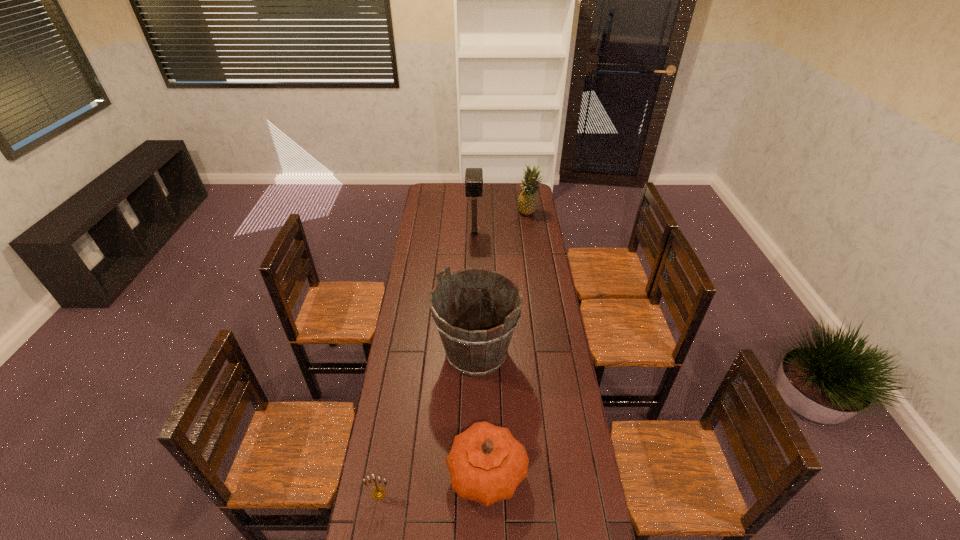
Locate an element on the screen. mallet is located at coordinates (473, 176).

You are a GUI agent. You are given a task and a screenshot of the screen. Output one action in this format:
    pyautogui.click(x=<x>, y=<y>)
    Task: Click on the bucket
    
    Given the screenshot: What is the action you would take?
    pyautogui.click(x=476, y=343)

At what (x,y) coordinates should I click in order to perform the action: click on pineapple. Please return your answer as a coordinate pair (x, y). The width and height of the screenshot is (960, 540). Looking at the image, I should click on (527, 201).

Image resolution: width=960 pixels, height=540 pixels. Find the location of `the rightmost object`. the rightmost object is located at coordinates (527, 201).

At what (x,y) coordinates should I click in order to perform the action: click on the second shortest object. Please return your answer as a coordinate pair (x, y). This screenshot has height=540, width=960. Looking at the image, I should click on (486, 463).

The image size is (960, 540). I want to click on the leftmost object, so click(x=378, y=493).

Locate an element on the screen. the shortest object is located at coordinates (378, 493).

Where is `free space located 0.270m on the back of the fourth nearest object`? free space located 0.270m on the back of the fourth nearest object is located at coordinates (475, 201).

Locate an element on the screen. free space located 0.210m on the front of the third farthest object is located at coordinates (476, 437).

Locate an element on the screen. Image resolution: width=960 pixels, height=540 pixels. vacant space located 0.250m on the left of the rightmost object is located at coordinates (476, 212).